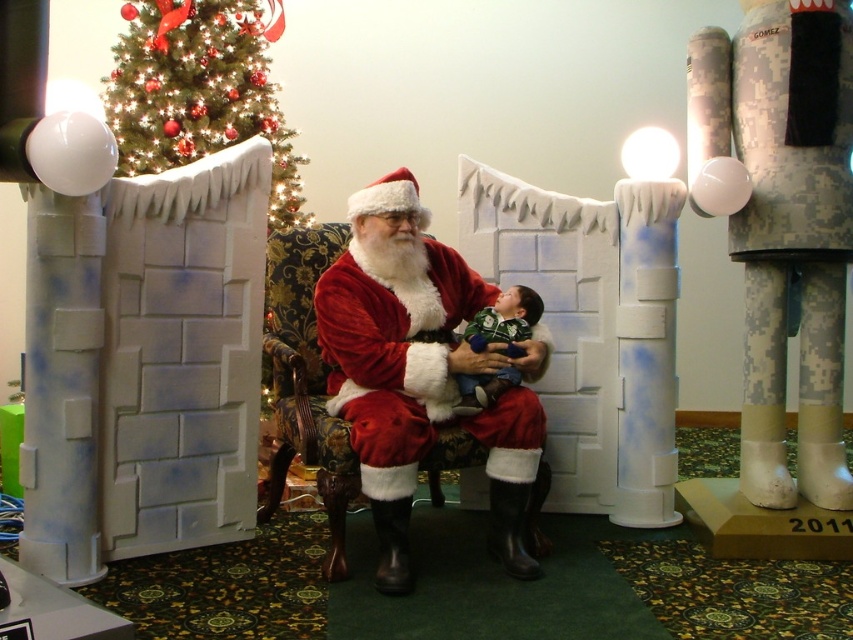
Who is more distant from viewer, (809, 125) or (128, 83)?

Point (128, 83)

Can you confirm if camouflage fabric santa at center is smaller than green matte christmas tree at upper left?

No.

Which is in front, point (775, 188) or point (184, 33)?

Point (775, 188)

Find the location of a particular element. Image resolution: width=853 pixels, height=640 pixels. camouflage fabric santa at center is located at coordinates (784, 225).

Measure the distance between point (761, 237) and camera.

8.16 feet

Is camouflage fabric santa at center to the left of green fuzzy sweater at center from the viewer's perspective?

Incorrect, camouflage fabric santa at center is not on the left side of green fuzzy sweater at center.

Does point (776, 420) lie in front of point (480, 392)?

No, it is not.

This screenshot has width=853, height=640. Identify the location of camouflage fabric santa at center. (784, 225).

Between velvet red santa at center and green matte christmas tree at upper left, which one appears on the left side from the viewer's perspective?

green matte christmas tree at upper left is more to the left.

Between point (427, 346) and point (154, 88), which one is positioned in front?

Point (427, 346) is more forward.

Who is more forward, (358, 326) or (125, 36)?

Point (358, 326)

The image size is (853, 640). In order to click on velvet red santa at center in this screenshot , I will do `click(399, 349)`.